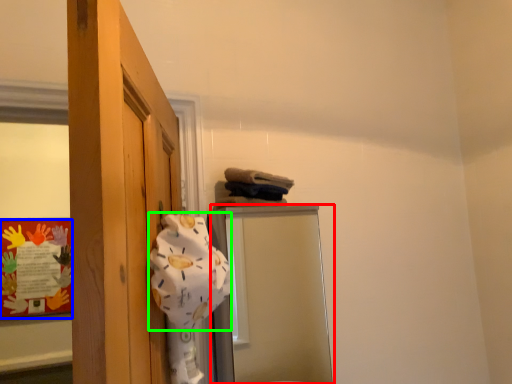
Question: Considering the real-world distances, which object is farthest from mirror (highlighted by a red box)? bulletin board (highlighted by a blue box) or bath towel (highlighted by a green box)?

Choices:
 (A) bulletin board
 (B) bath towel

Answer: (B)